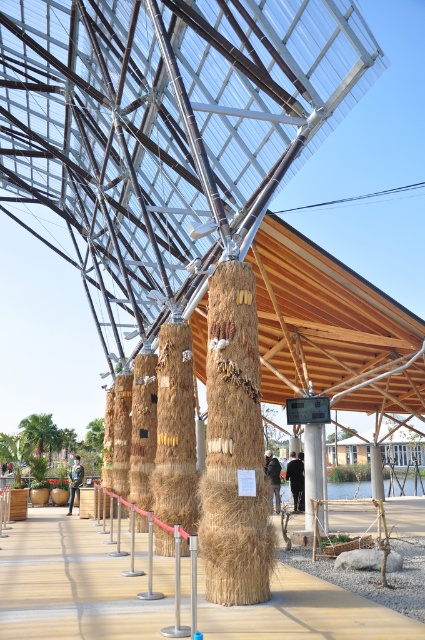
You are standing on the wooden walkway at center and want to reach the entrance located behind the braided straw column at center. Can you walk directly towards it without moving around the column?

The wooden walkway at center is positioned under the braided straw column at center, so you can walk directly towards the entrance behind the column by going under it.

You are standing on the wooden walkway at center and want to reach the braided straw column at center. In which direction should you move?

The wooden walkway at center is to the left of braided straw column at center, so you should move to the right to reach the braided straw column at center.